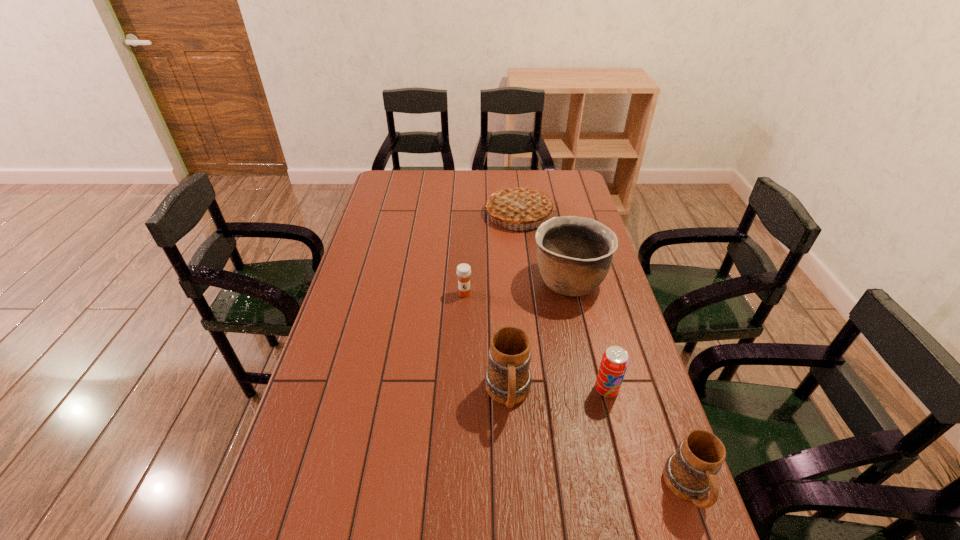
Locate an element on the screen. free spot located 0.140m on the back of the farthest object is located at coordinates (515, 180).

The image size is (960, 540). Find the location of `free space located on the label side of the medicine`. free space located on the label side of the medicine is located at coordinates (462, 359).

Where is `free space located 0.270m on the left of the pottery`? The width and height of the screenshot is (960, 540). free space located 0.270m on the left of the pottery is located at coordinates (452, 281).

Identify the location of free space located 0.080m on the left of the soda can. (564, 389).

Where is `object at the far edge`? object at the far edge is located at coordinates (517, 204).

Find the location of a particular element. The width and height of the screenshot is (960, 540). object that is at the near edge is located at coordinates (689, 473).

The image size is (960, 540). Find the location of `mug that is positioned at the right edge`. mug that is positioned at the right edge is located at coordinates (689, 473).

Where is `pie positioned at the right edge`? The image size is (960, 540). pie positioned at the right edge is located at coordinates (517, 204).

Where is `pottery located in the right edge section of the desktop`? Image resolution: width=960 pixels, height=540 pixels. pottery located in the right edge section of the desktop is located at coordinates (574, 254).

The image size is (960, 540). In order to click on soda can positioned at the right edge in this screenshot , I will do `click(614, 363)`.